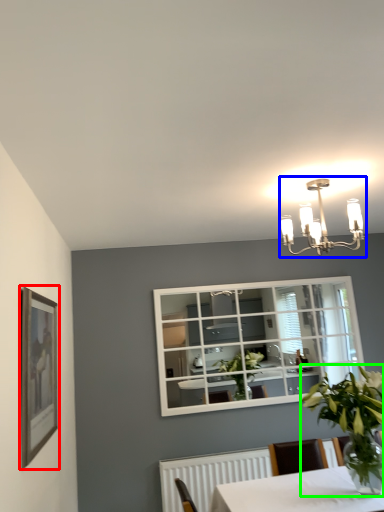
Question: Which object is positioned farthest from picture frame (highlighted by a red box)? Select from lamp (highlighted by a blue box) and houseplant (highlighted by a green box).

Choices:
 (A) lamp
 (B) houseplant

Answer: (A)